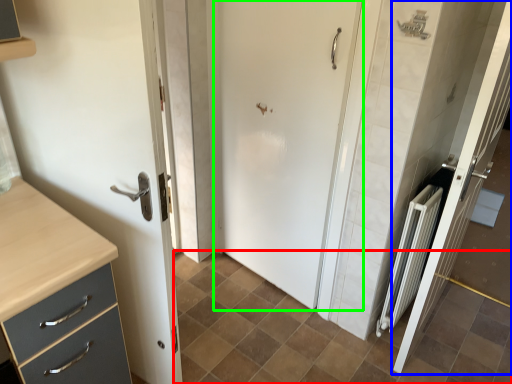
Question: Based on their relative distances, which object is farther from ceramic tile (highlighted by a red box)? Choose from door (highlighted by a blue box) and door (highlighted by a green box).

Choices:
 (A) door
 (B) door

Answer: (B)